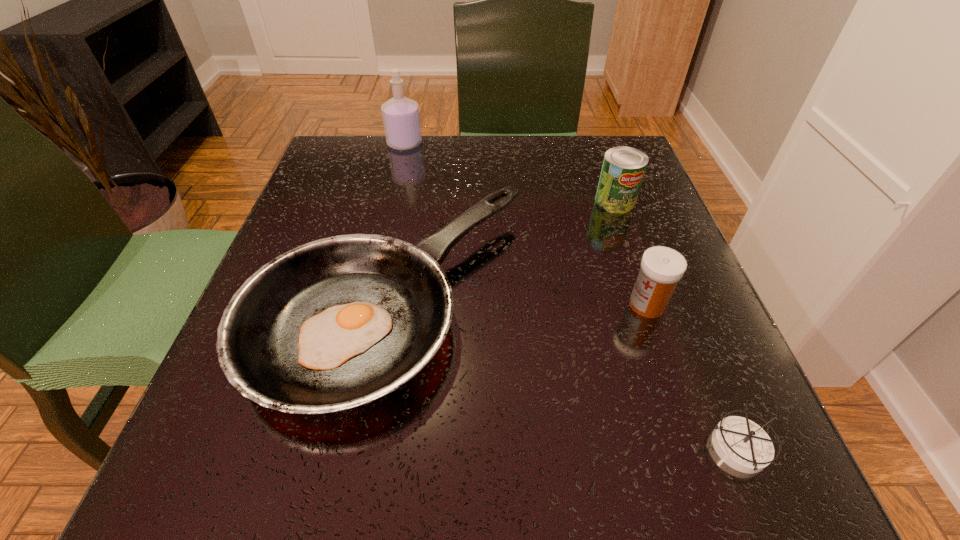
The image size is (960, 540). In order to click on unoccupied position between the frying pan and the can in this screenshot , I will do point(502,250).

The height and width of the screenshot is (540, 960). I want to click on empty space between the medicine and the tallest object, so click(x=526, y=224).

Locate which object ranks in proximity to the shortest object. Please provide its 2D coordinates. Your answer should be formatted as a tuple, i.e. [(x, y)], where the tuple contains the x and y coordinates of a point satisfying the conditions above.

[(661, 268)]

Where is `object that is the second closest one to the shortest object`? Image resolution: width=960 pixels, height=540 pixels. object that is the second closest one to the shortest object is located at coordinates (336, 323).

Find the location of a particular element. free space that satisfies the following two spatial constraints: 1. on the front side of the perfume; 2. on the right side of the compass is located at coordinates [334, 448].

Find the location of a particular element. vacant position in the image that satisfies the following two spatial constraints: 1. on the front side of the can; 2. on the right side of the perfume is located at coordinates (392, 201).